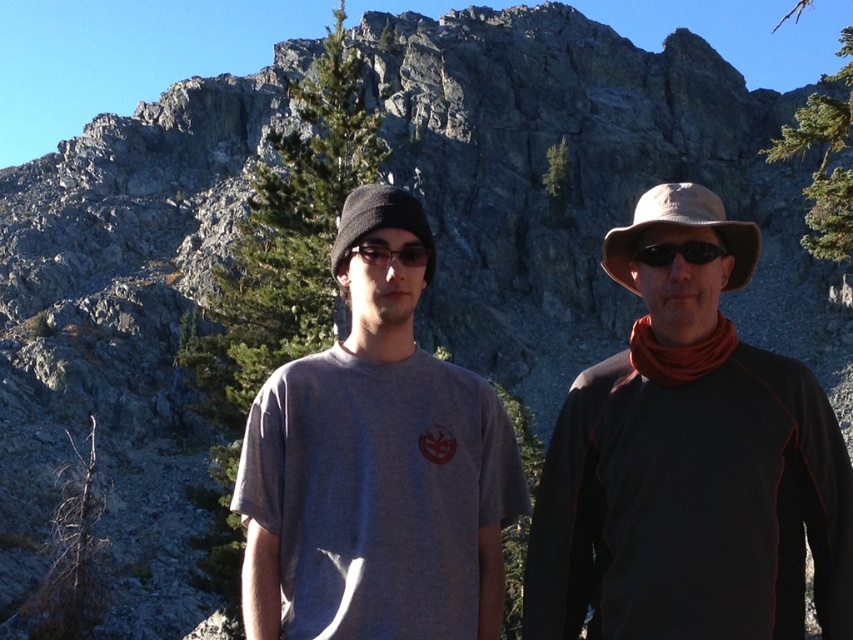
You are a photographer aiming to capture a portrait of the two people in the scene. You want to ensure the green textured pine at upper right and the black matte sunglasses at center are both visible in the frame. Based on their positions, which object should you prioritize keeping centered to ensure both are in the shot?

The black matte sunglasses at center should be prioritized as the green textured pine at upper right is located to the right of it, so centering the sunglasses allows the pine to naturally fall into the frame on the right side.

You are a photographer trying to capture a clear shot of the green textured pine at upper right and the black matte sunglasses at center. Which object should you focus on first to ensure both are in focus?

You should focus on the green textured pine at upper right first because it is closer to you than the black matte sunglasses at center, so focusing on the closer object first will help ensure both are in focus.